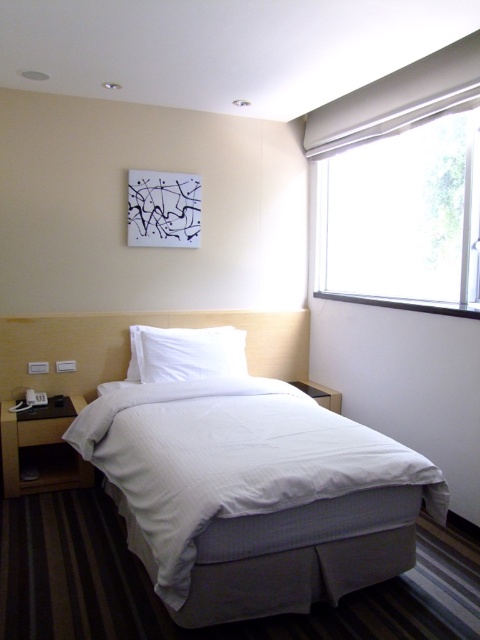
Between white textured bedsheet at center and white soft pillow at center, which one is positioned lower?

Positioned lower is white textured bedsheet at center.

Is point (423, 474) farther from viewer compared to point (193, 356)?

No.

This screenshot has height=640, width=480. What are the coordinates of `white textured bedsheet at center` in the screenshot? It's located at (232, 460).

Is point (350, 161) positioned after point (145, 352)?

Yes, point (350, 161) is farther from viewer.

Does white matte window at upper right come in front of white soft pillow at center?

Yes, white matte window at upper right is closer to the viewer.

You are a GUI agent. You are given a task and a screenshot of the screen. Output one action in this format:
    pyautogui.click(x=<x>, y=<y>)
    Task: Click on the white matte window at upper right
    
    Given the screenshot: What is the action you would take?
    pyautogui.click(x=403, y=216)

Is white textured bedsheet at center above white matte window at upper right?

Actually, white textured bedsheet at center is below white matte window at upper right.

Can you confirm if white textured bedsheet at center is wider than white matte window at upper right?

Yes.

Where is `white textured bedsheet at center`? white textured bedsheet at center is located at coordinates [232, 460].

You are a GUI agent. You are given a task and a screenshot of the screen. Output one action in this format:
    pyautogui.click(x=<x>, y=<y>)
    Task: Click on the white textured bedsheet at center
    The width and height of the screenshot is (480, 640).
    Given the screenshot: What is the action you would take?
    pyautogui.click(x=232, y=460)